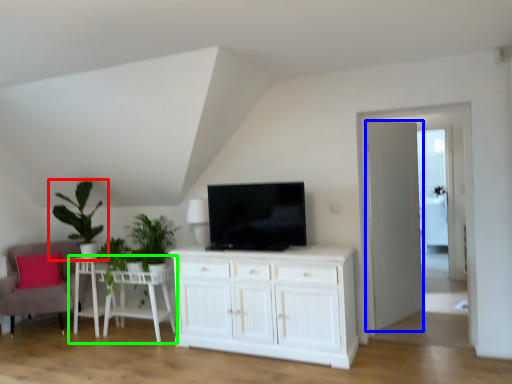
Question: Considering the real-world distances, which object is closest to houseplant (highlighted by a red box)? door (highlighted by a blue box) or table (highlighted by a green box).

Choices:
 (A) door
 (B) table

Answer: (B)